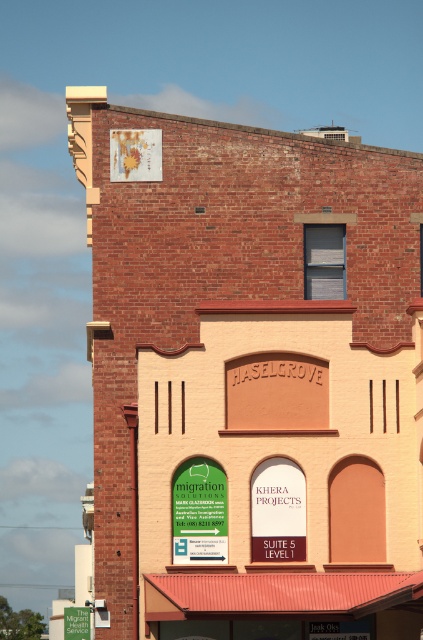
Between brick building at center and metallic red awning at lower center, which one appears on the left side from the viewer's perspective?

brick building at center is more to the left.

How much distance is there between brick building at center and metallic red awning at lower center?

brick building at center is 21.65 feet away from metallic red awning at lower center.

Is point (305, 589) farther from viewer compared to point (323, 600)?

Yes, point (305, 589) is farther from viewer.

Identify the location of brick building at center. Image resolution: width=423 pixels, height=640 pixels. (252, 374).

Is point (348, 589) positioned in front of point (189, 513)?

Yes, point (348, 589) is closer to viewer.

Does point (384, 579) lie behind point (197, 541)?

No, it is in front of (197, 541).

The height and width of the screenshot is (640, 423). What are the coordinates of `metallic red awning at lower center` in the screenshot? It's located at (277, 595).

This screenshot has height=640, width=423. I want to click on metallic red awning at lower center, so click(x=277, y=595).

The width and height of the screenshot is (423, 640). In order to click on brick building at center in this screenshot , I will do `click(252, 374)`.

Does brick building at center come behind green plastic sign at lower left?

That is False.

Who is more forward, (296, 413) or (222, 502)?

Point (222, 502) is more forward.

I want to click on brick building at center, so click(252, 374).